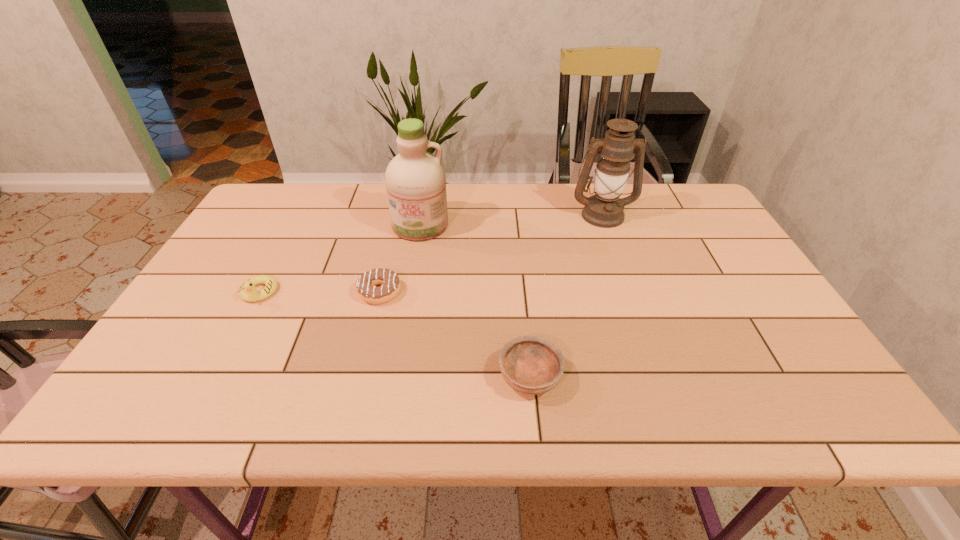
In the image, there is a desktop. Find the location of `blank space at the far right corner`. blank space at the far right corner is located at coordinates point(696,191).

The image size is (960, 540). Find the location of `free space between the cleansing agent and the doughnut`. free space between the cleansing agent and the doughnut is located at coordinates (400, 259).

This screenshot has width=960, height=540. I want to click on vacant region between the rightmost object and the duckling, so click(x=431, y=253).

Where is `free point between the doughnut and the cleansing agent`? The height and width of the screenshot is (540, 960). free point between the doughnut and the cleansing agent is located at coordinates (400, 259).

This screenshot has width=960, height=540. In order to click on vacant area that lies between the doughnut and the rightmost object in this screenshot , I will do `click(491, 253)`.

I want to click on vacant point located between the leftmost object and the cleansing agent, so click(x=340, y=259).

I want to click on free space that is in between the cleansing agent and the rightmost object, so click(512, 220).

Identify the location of vacant point located between the bowl and the cleansing agent. pyautogui.click(x=475, y=301).

You are a GUI agent. You are given a task and a screenshot of the screen. Output one action in this format:
    pyautogui.click(x=<x>, y=<y>)
    Task: Click on the free point between the doughnut and the cleansing agent
    
    Given the screenshot: What is the action you would take?
    pyautogui.click(x=400, y=259)

Find the location of a particular element. The width and height of the screenshot is (960, 540). vacant region between the doughnut and the leftmost object is located at coordinates (320, 292).